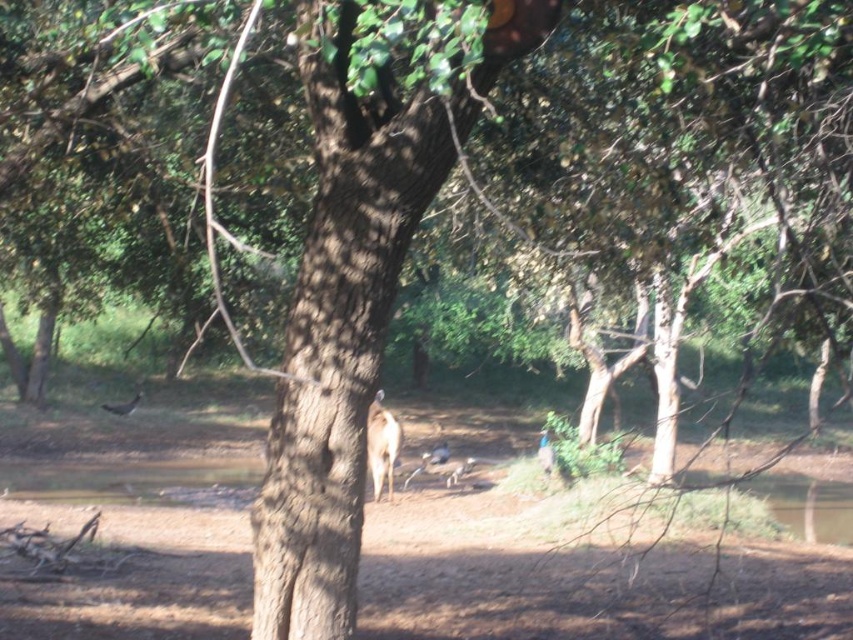
Between brown fur antelope at center and brown furry animal at center, which one is positioned lower?

brown fur antelope at center is below.

Is brown fur antelope at center shorter than brown furry animal at center?

Indeed, brown fur antelope at center has a lesser height compared to brown furry animal at center.

Who is more forward, [442,454] or [548,449]?

Point [548,449] is more forward.

Where is `brown fur antelope at center`? The width and height of the screenshot is (853, 640). brown fur antelope at center is located at coordinates (428, 461).

Which of these two, brown furry deer at center or brown furry animal at center, stands shorter?

brown furry animal at center is shorter.

Can you confirm if brown furry deer at center is wider than brown furry animal at center?

Yes, brown furry deer at center is wider than brown furry animal at center.

Locate an element on the screen. The height and width of the screenshot is (640, 853). brown furry deer at center is located at coordinates (381, 445).

This screenshot has height=640, width=853. In order to click on brown furry deer at center in this screenshot , I will do `click(381, 445)`.

Is point (259, 628) farther from camera compared to point (131, 403)?

That is False.

Does brown rough tree trunk at center lie in front of brown feathered bird at lower left?

Yes.

Image resolution: width=853 pixels, height=640 pixels. I want to click on brown rough tree trunk at center, so click(x=337, y=330).